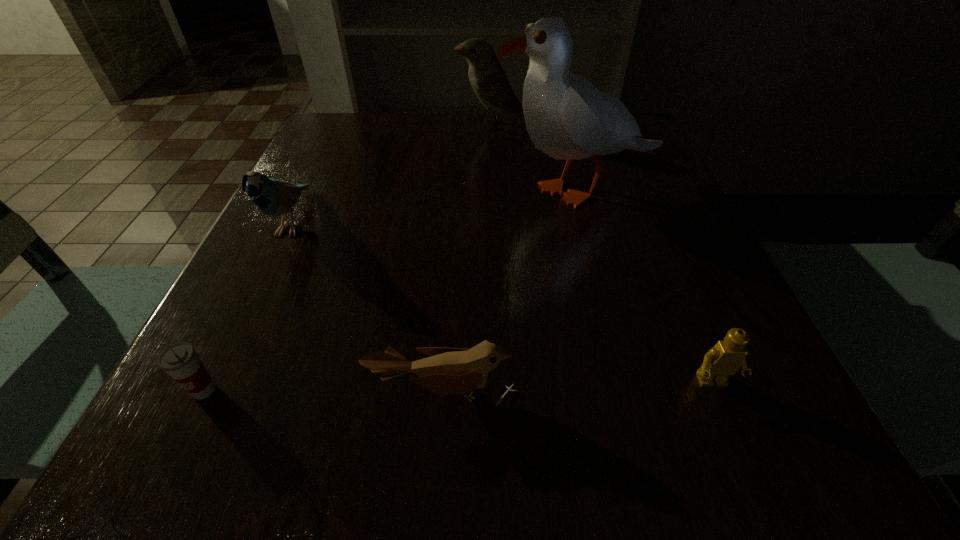
Locate an element on the screen. The image size is (960, 540). blank space located at the beak of the gull is located at coordinates (419, 191).

Find the location of a particular element. This screenshot has width=960, height=540. free space located at the face of the fifth shortest object is located at coordinates (368, 126).

Find the location of `vacant space located at the face of the fifth shortest object`. vacant space located at the face of the fifth shortest object is located at coordinates (348, 126).

Image resolution: width=960 pixels, height=540 pixels. I want to click on vacant space situated at the face of the fifth shortest object, so click(335, 126).

Image resolution: width=960 pixels, height=540 pixels. Find the location of `free space located 0.120m at the face of the leftmost bird`. free space located 0.120m at the face of the leftmost bird is located at coordinates coord(248,315).

Locate an element on the screen. blank space located 0.050m on the side of the cup with the logo is located at coordinates (178, 442).

Identify the location of free space located 0.070m on the face of the Lego. (740, 448).

Image resolution: width=960 pixels, height=540 pixels. Find the location of `object located at the far edge`. object located at the far edge is located at coordinates (489, 81).

I want to click on object located at the near edge, so click(x=449, y=371).

Find the location of a particular element. The height and width of the screenshot is (540, 960). bird situated at the left edge is located at coordinates (273, 197).